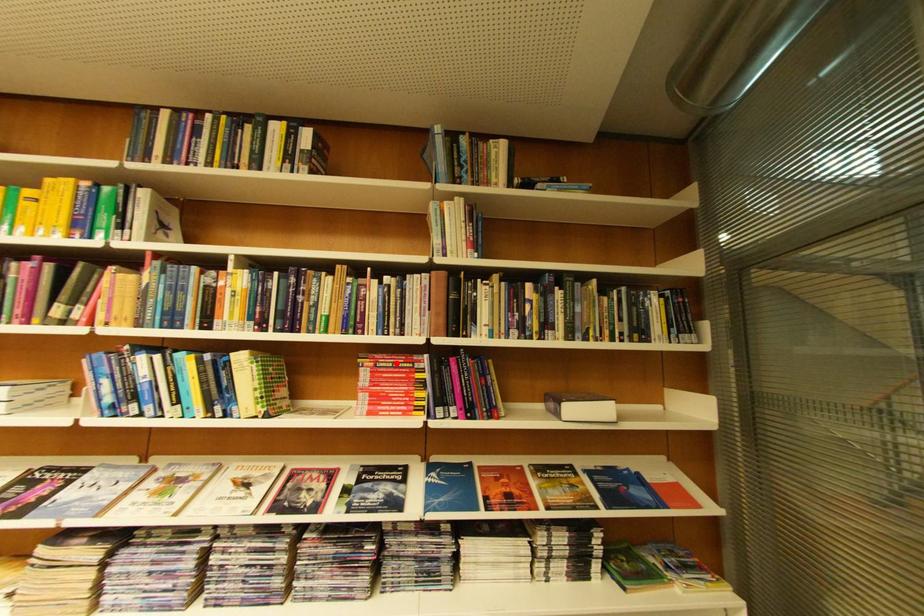
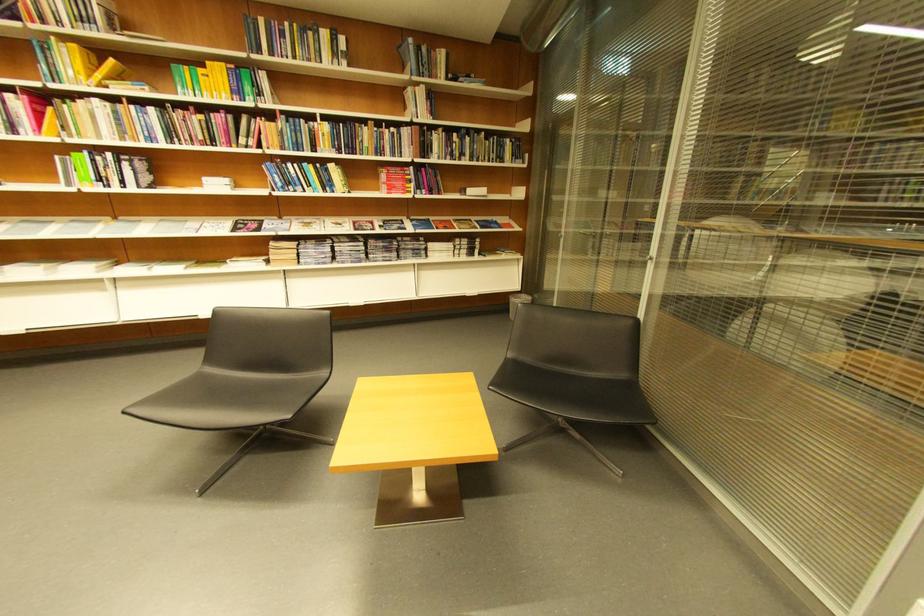
Question: I am providing you with two images of the same scene from different viewpoints. Given a red point in image1, look at the same physical point in image2. Is it:

Choices:
 (A) Closer to the viewpoint
 (B) Farther from the viewpoint

Answer: (A)